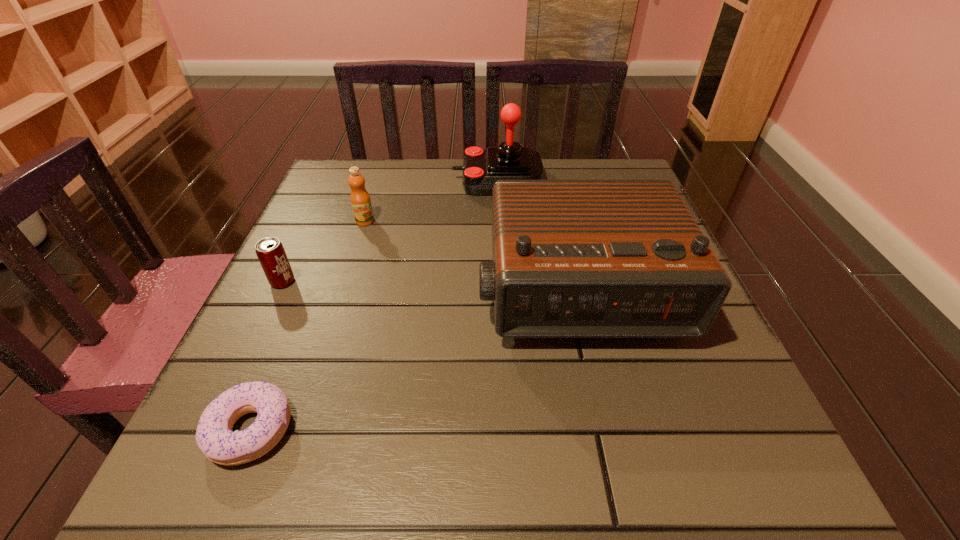
In order to click on free space that satisfies the following two spatial constraints: 1. on the base of the joystick; 2. on the front label of the orange juice in this screenshot , I will do `click(501, 221)`.